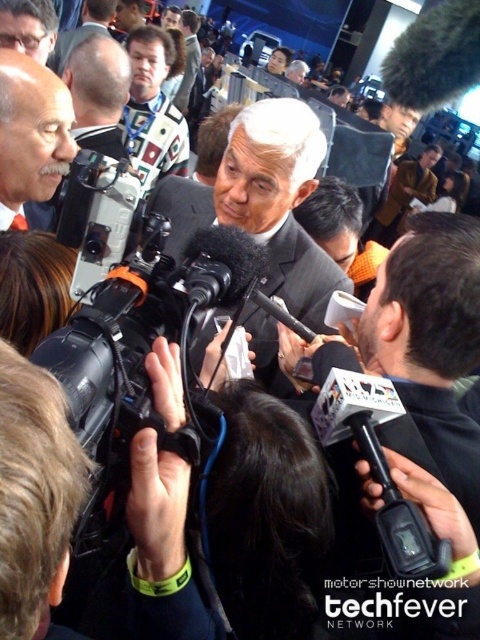
Is matte black suit at center wider than light brown suit at center?

In fact, matte black suit at center might be narrower than light brown suit at center.

Between matte black suit at center and light brown suit at center, which one is positioned lower?

matte black suit at center is below.

The image size is (480, 640). In order to click on matte black suit at center in this screenshot , I will do `click(28, 26)`.

This screenshot has height=640, width=480. Find the location of `matte black suit at center`. matte black suit at center is located at coordinates (28, 26).

Is point (10, 65) farther from camera compared to point (187, 157)?

That is False.

Between white matte suit at center and white textured shirt at center, which one is positioned lower?

white matte suit at center

Between point (33, 86) and point (177, 168), which one is positioned behind?

The point (177, 168) is more distant.

Image resolution: width=480 pixels, height=640 pixels. In order to click on white matte suit at center in this screenshot , I will do `click(31, 134)`.

Is white textured shirt at center in front of matte black suit at center?

No, it is not.

Which is more to the right, white textured shirt at center or matte black suit at center?

From the viewer's perspective, white textured shirt at center appears more on the right side.

Locate an element on the screen. The width and height of the screenshot is (480, 640). white textured shirt at center is located at coordinates click(x=153, y=108).